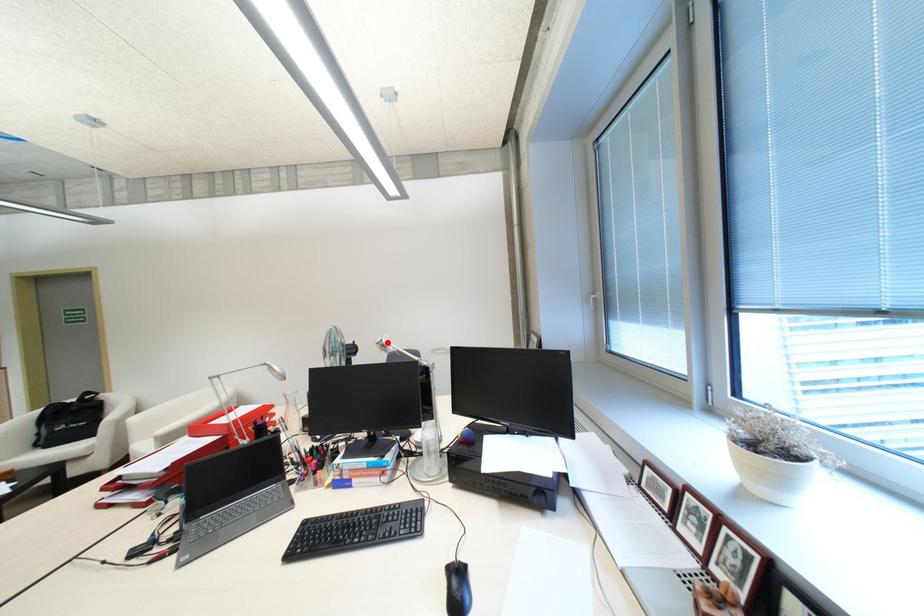
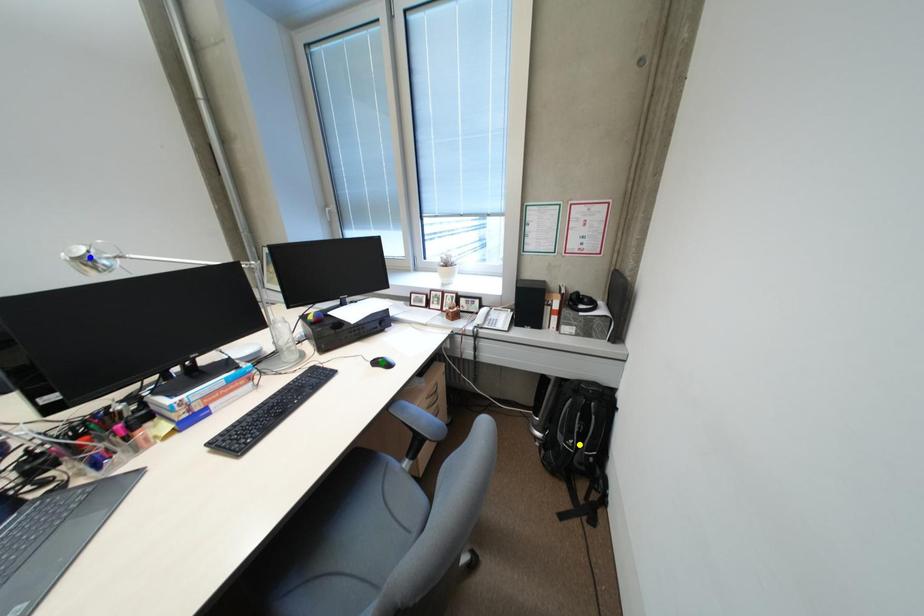
Question: I am providing you with two images of the same scene from different viewpoints. A red point is marked on the first image. You are given multiple points on the second image. Which mark in image 2 goes with the point in image 1?

Choices:
 (A) green point
 (B) blue point
 (C) yellow point

Answer: (B)